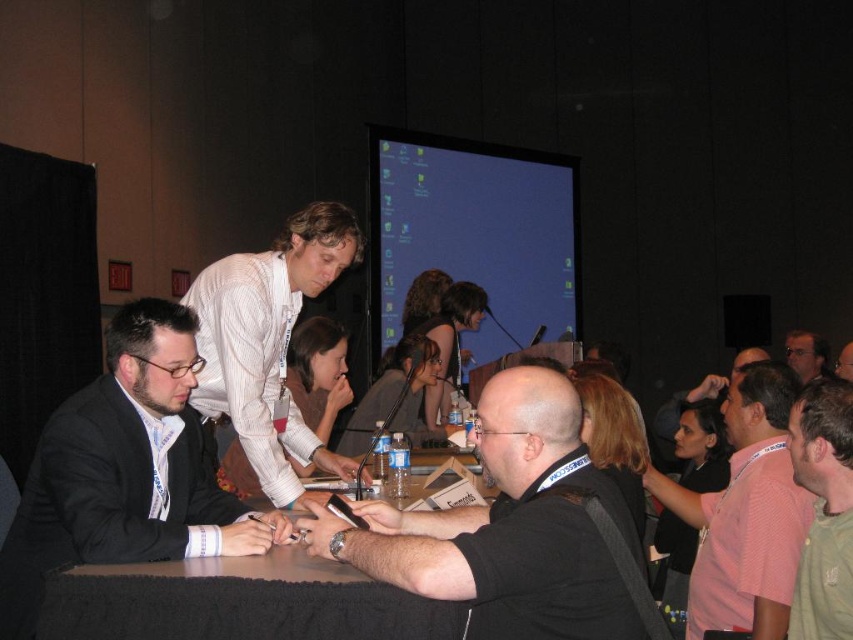
You are attending the event and want to get a clear photo of the black matte shirt at center and the smooth white table at center. Which object will appear larger in your photo?

The black matte shirt at center will appear larger in the photo because it is closer to the viewer than the smooth white table at center.